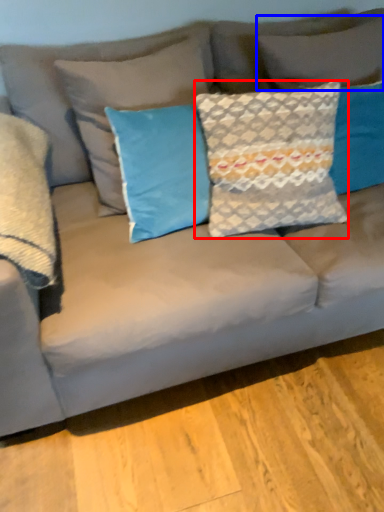
Question: Which point is further to the camera, pillow (highlighted by a red box) or pillow (highlighted by a blue box)?

Choices:
 (A) pillow
 (B) pillow

Answer: (B)